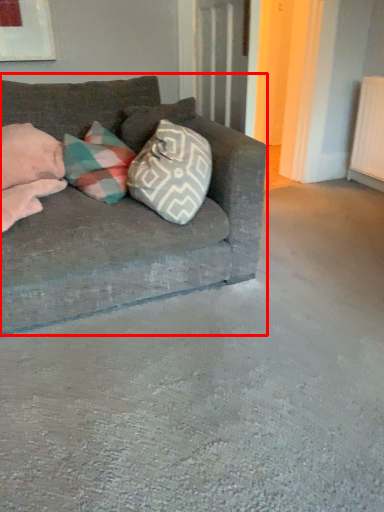
Question: From the image's perspective, what is the correct spatial positioning of studio couch (annotated by the red box) in reference to pillow?

Choices:
 (A) above
 (B) below

Answer: (B)